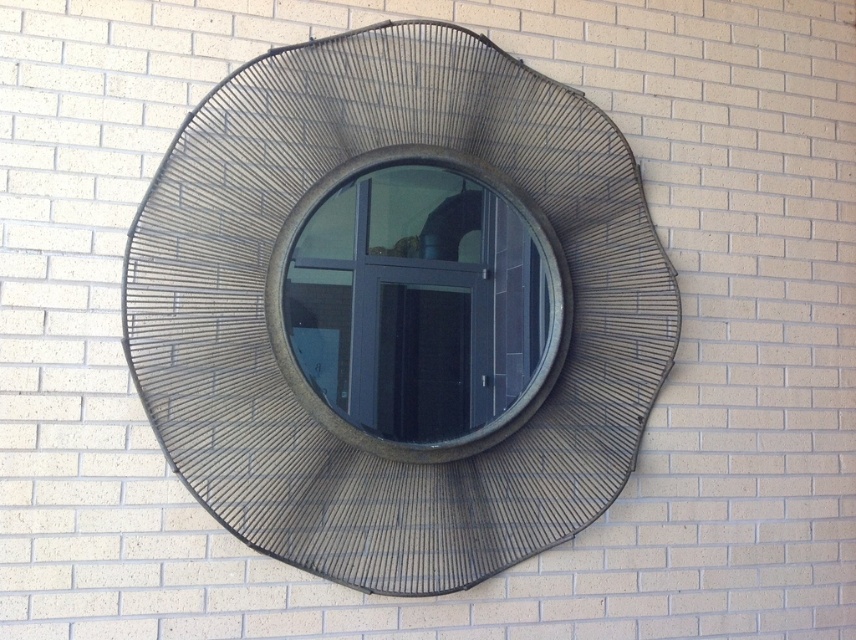
Can you confirm if metallic wire mesh at center is bigger than matte glass window at center?

Correct, metallic wire mesh at center is larger in size than matte glass window at center.

Which is behind, point (271, 474) or point (390, 244)?

The point (390, 244) is more distant.

The width and height of the screenshot is (856, 640). Find the location of `metallic wire mesh at center`. metallic wire mesh at center is located at coordinates (265, 330).